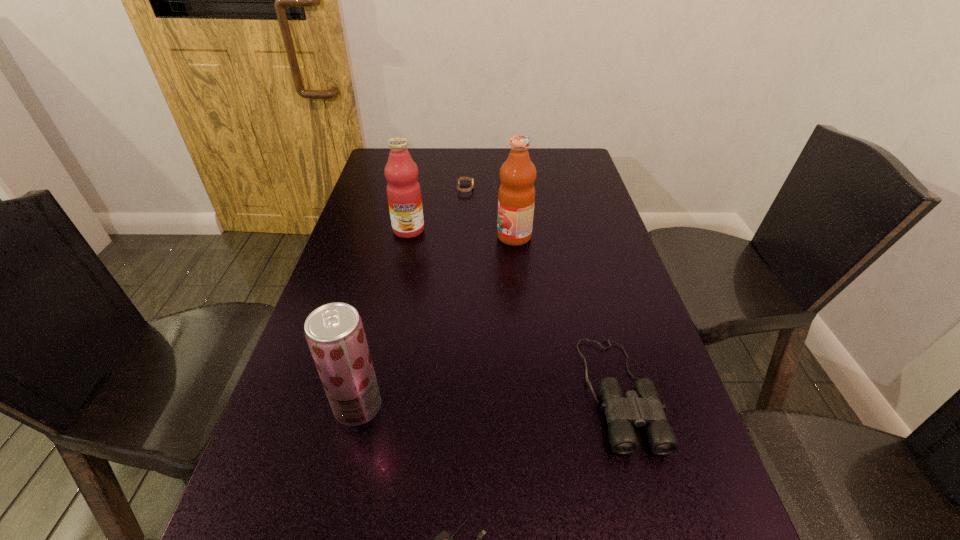
At what (x,y) coordinates should I click in order to perform the action: click on the rightmost fruit juice. Please return your answer as a coordinate pair (x, y). Looking at the image, I should click on (516, 197).

This screenshot has width=960, height=540. I want to click on the nearest fruit juice, so [334, 332].

At what (x,y) coordinates should I click in order to perform the action: click on the shortest fruit juice. Please return your answer as a coordinate pair (x, y). The height and width of the screenshot is (540, 960). Looking at the image, I should click on (334, 332).

Where is `the rightmost object`? the rightmost object is located at coordinates (642, 407).

The image size is (960, 540). Identify the location of binoculars. (642, 407).

Where is `watch`? watch is located at coordinates (461, 178).

Identify the location of the second shortest object. pyautogui.click(x=461, y=178).

This screenshot has height=540, width=960. Find the location of `free space located on the front label of the rightmost fruit juice`. free space located on the front label of the rightmost fruit juice is located at coordinates (466, 237).

Find the location of a particular element. vacant region located on the front label of the rightmost fruit juice is located at coordinates (404, 237).

This screenshot has width=960, height=540. What are the coordinates of `blank space located 0.170m on the front label of the rightmost fruit juice` in the screenshot? It's located at (439, 237).